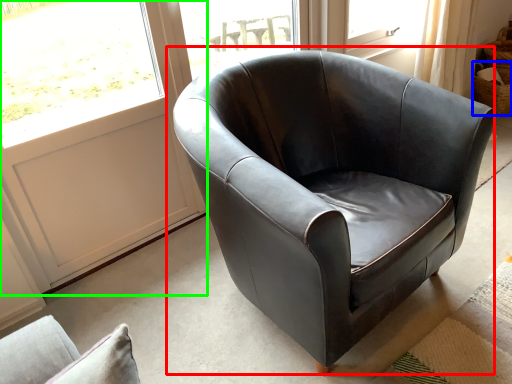
Question: Based on their relative distances, which object is nearer to chair (highlighted by a red box)? Choose from basket (highlighted by a blue box) and screen door (highlighted by a green box).

Choices:
 (A) basket
 (B) screen door

Answer: (B)